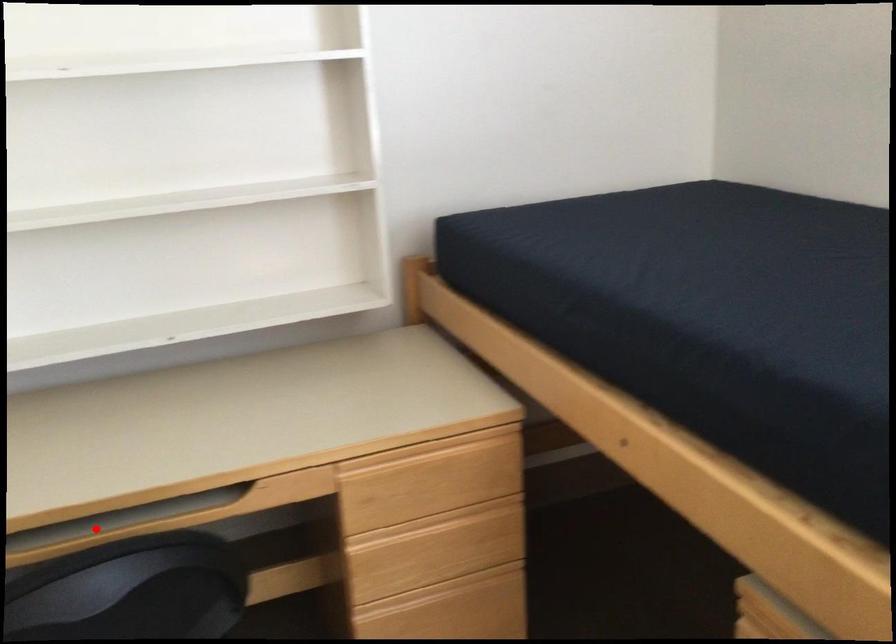
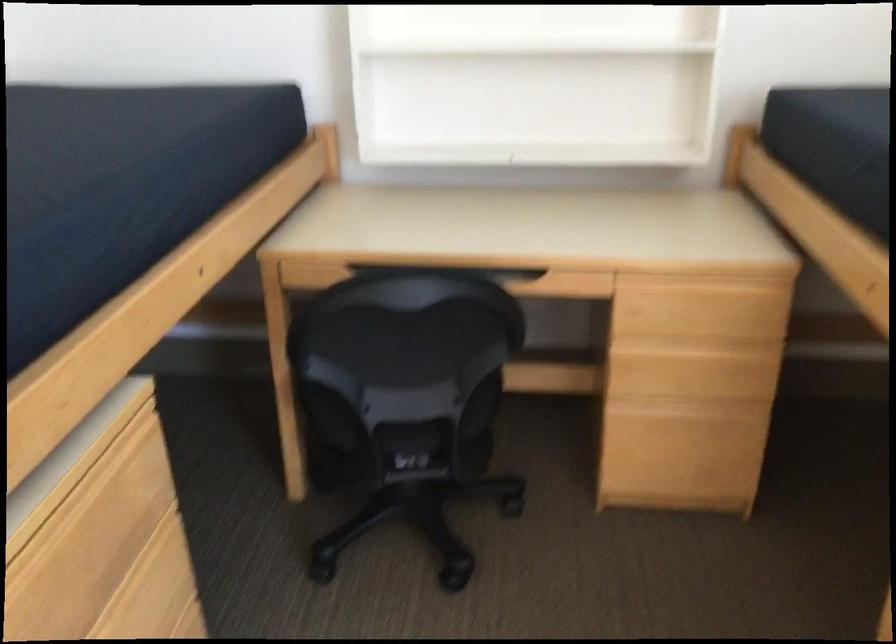
Question: I am providing you with two images of the same scene from different viewpoints. A red point is marked on the first image. Can you still see the location of the red point in image 2?

Choices:
 (A) Yes
 (B) No

Answer: (B)